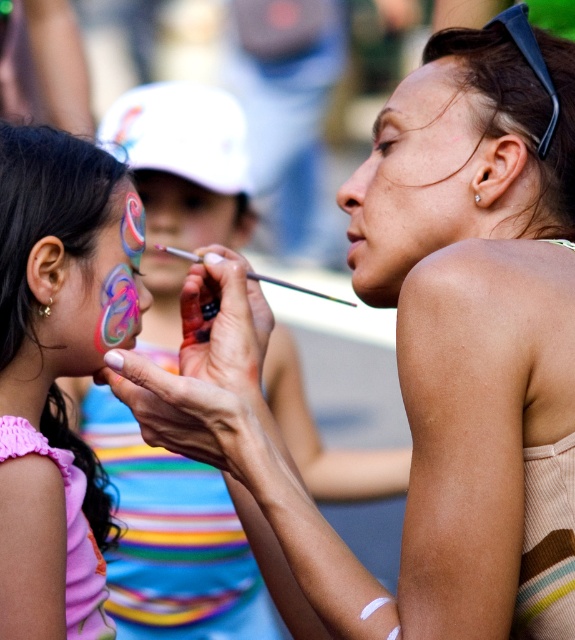
Question: Is matte skin at center wider than matte paintbrush at center?

Choices:
 (A) yes
 (B) no

Answer: (B)

Question: Is shiny pink face paint at left below matte paintbrush at center?

Choices:
 (A) no
 (B) yes

Answer: (B)

Question: Which point appears farthest from the camera in this image?

Choices:
 (A) (409, 102)
 (B) (71, 371)
 (C) (151, 200)

Answer: (C)

Question: Is shiny metallic face paint at left below matte paintbrush at center?

Choices:
 (A) no
 (B) yes

Answer: (B)

Question: Which point is farther to the camera?

Choices:
 (A) matte paintbrush at center
 (B) matte skin at center

Answer: (A)

Question: Which point is closer to the camera?

Choices:
 (A) shiny pink face paint at left
 (B) matte skin at center
 (C) matte paintbrush at center

Answer: (B)